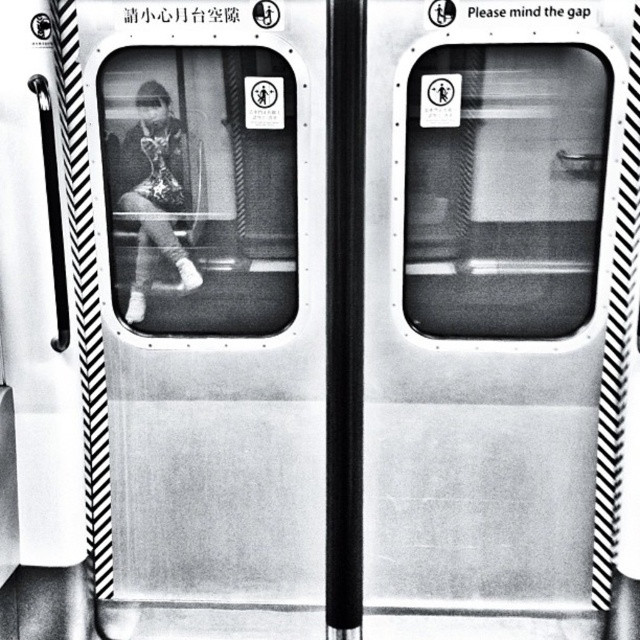
You are a passenger on the subway and want to hold onto something stable while the train is moving. The metallic silver door at left and the black glossy pole at center are both in view. Which object would you choose to grip for better stability?

You should choose the black glossy pole at center because poles are typically designed for holding onto, whereas doors are not meant to be gripped for stability during movement.

You are a passenger standing in the subway car and want to hold onto something. The black glossy pole at center and the matte black jacket at center are both in front of you. Which object is narrower so you can easily grip it?

The black glossy pole at center is narrower than the matte black jacket at center, so it is easier to grip.